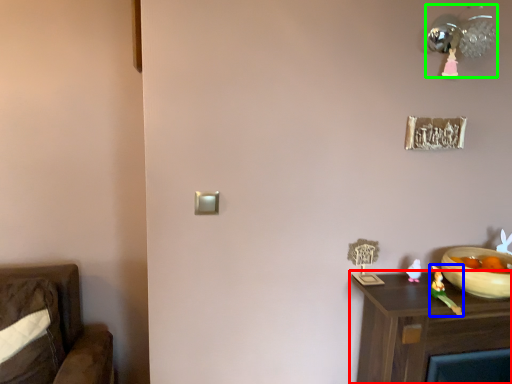
Question: Based on their relative distances, which object is farther from nightstand (highlighted by a red box)? Choose from toy (highlighted by a blue box) and light fixture (highlighted by a green box).

Choices:
 (A) toy
 (B) light fixture

Answer: (B)